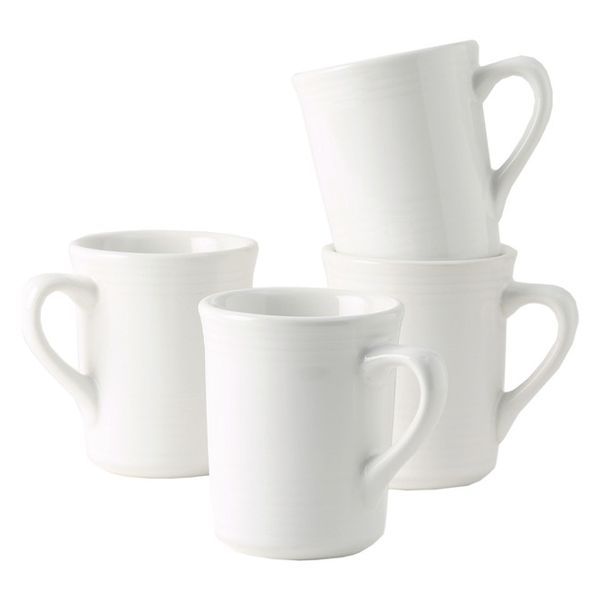
You are a GUI agent. You are given a task and a screenshot of the screen. Output one action in this format:
    pyautogui.click(x=<x>, y=<y>)
    Task: Click on the cups
    This screenshot has height=600, width=600.
    Given the screenshot: What is the action you would take?
    pyautogui.click(x=407, y=222), pyautogui.click(x=93, y=261), pyautogui.click(x=256, y=366), pyautogui.click(x=471, y=325)